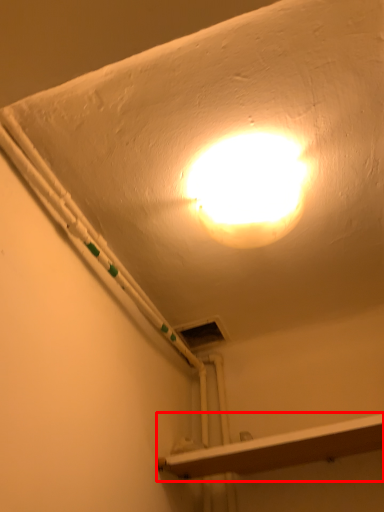
Question: From the image's perspective, where is shelf (annotated by the red box) located relative to lamp?

Choices:
 (A) above
 (B) below

Answer: (B)